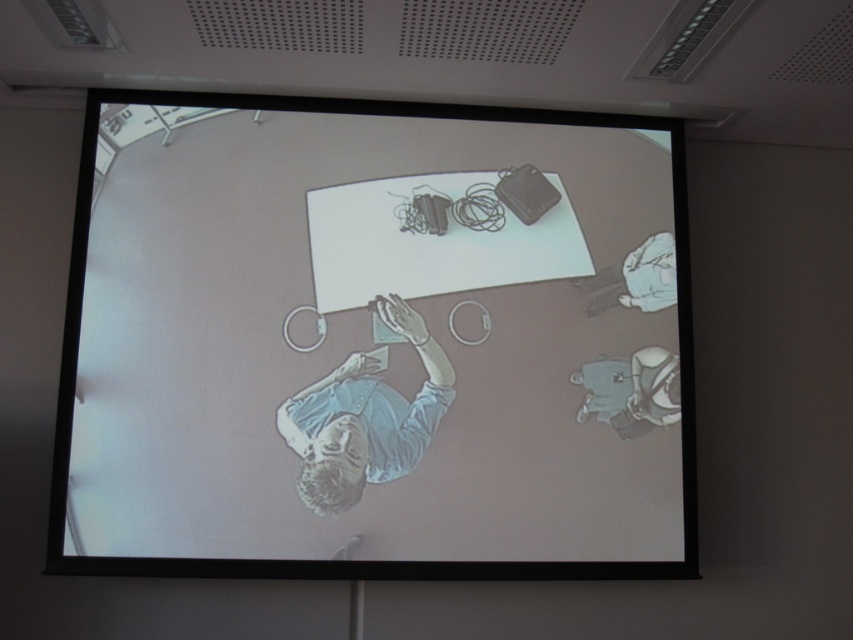
Question: Estimate the real-world distances between objects in this image. Which object is farther from the white fabric shirt at upper right?

Choices:
 (A) smooth gray shirt at lower right
 (B) white glossy projector screen at upper center

Answer: (B)

Question: Can you confirm if white glossy projector screen at upper center is positioned to the left of smooth gray shirt at lower right?

Choices:
 (A) no
 (B) yes

Answer: (B)

Question: Does light blue fabric shirt at center appear on the right side of white fabric shirt at upper right?

Choices:
 (A) yes
 (B) no

Answer: (B)

Question: Which point is closer to the camera taking this photo?

Choices:
 (A) (598, 387)
 (B) (645, 252)
 (C) (387, 392)

Answer: (C)

Question: Which object appears closest to the camera in this image?

Choices:
 (A) white fabric shirt at upper right
 (B) light blue fabric shirt at center

Answer: (B)

Question: Does white glossy projector screen at upper center appear over light blue fabric shirt at center?

Choices:
 (A) no
 (B) yes

Answer: (B)